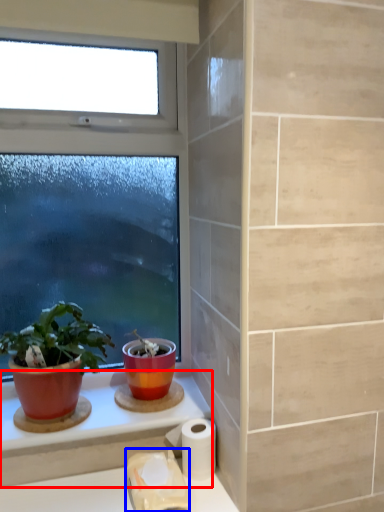
Question: Which point is closer to the camera, counter top (highlighted by a red box) or toilet paper (highlighted by a blue box)?

Choices:
 (A) counter top
 (B) toilet paper

Answer: (B)